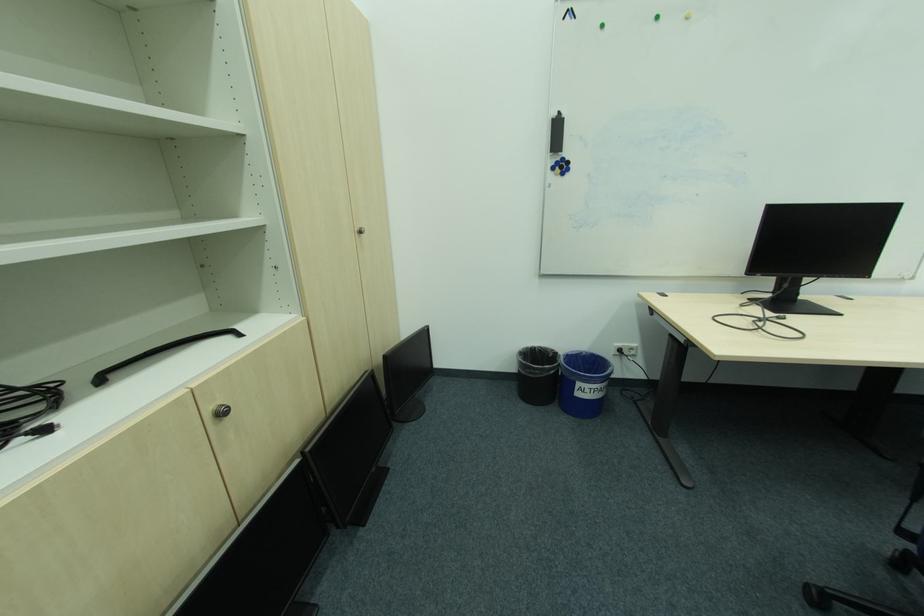
Find the location of a particular element. The width and height of the screenshot is (924, 616). light-colored magnet is located at coordinates (561, 166).